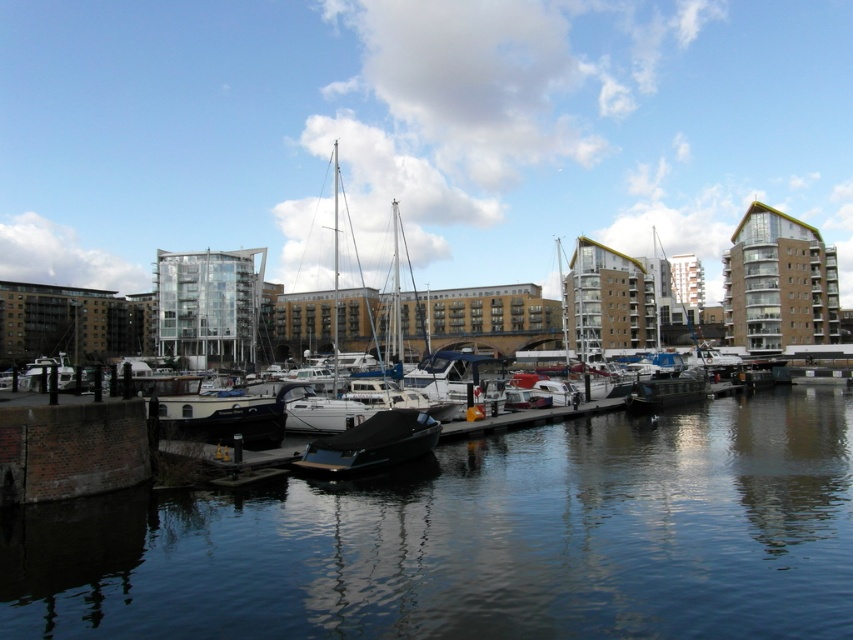
You are a photographer planning to take a photo of the waterfront scene. You notice the smooth dark water at center and the shiny black boat at center. Which object appears lower in the image?

The smooth dark water at center appears lower in the image because it has a lesser height compared to the shiny black boat at center.

From the picture: You are standing on the pier and want to locate the smooth dark water at center. According to the coordinates provided, where would you find it?

The smooth dark water at center is located at coordinates point [479,540].